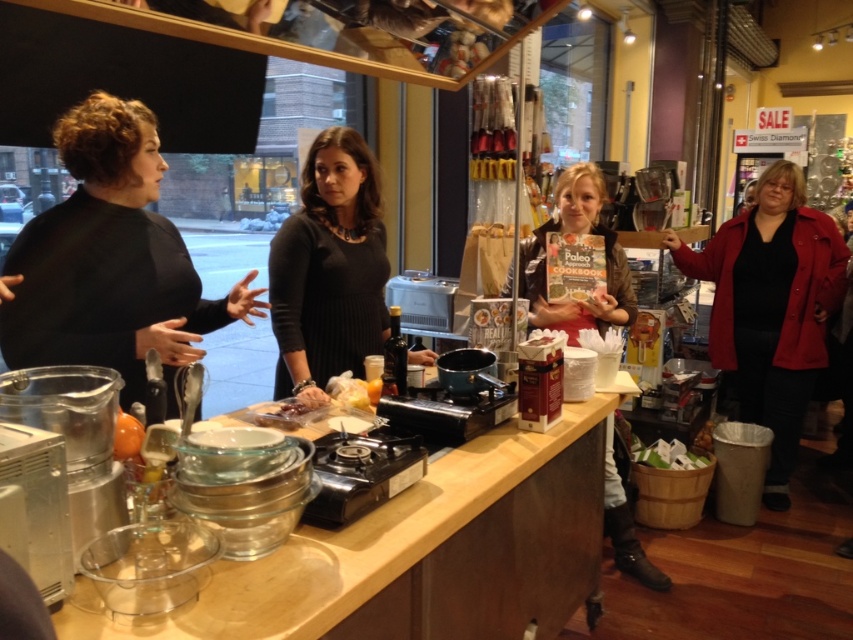
Question: Can you confirm if wooden counter at center is positioned above black matte sweater at left?

Choices:
 (A) yes
 (B) no

Answer: (B)

Question: Is matte red coat at right bigger than translucent glass bottle at center?

Choices:
 (A) no
 (B) yes

Answer: (B)

Question: Which object is positioned farthest from the black matte dress at center?

Choices:
 (A) black matte sweater at left
 (B) translucent glass bottle at center

Answer: (A)

Question: Is wooden counter at center bigger than brown leather jacket at center?

Choices:
 (A) yes
 (B) no

Answer: (A)

Question: Which point appears closest to the camera in this image?

Choices:
 (A) (821, 360)
 (B) (370, 634)
 (C) (387, 346)

Answer: (B)

Question: Which object is positioned closest to the matte red coat at right?

Choices:
 (A) brown leather jacket at center
 (B) black matte sweater at left

Answer: (A)